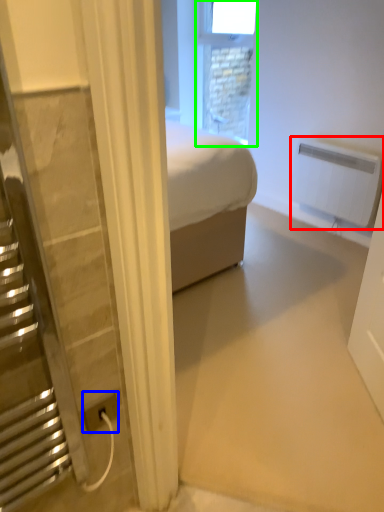
Question: Considering the real-world distances, which object is closest to radiator (highlighted by a red box)? power plugs and sockets (highlighted by a blue box) or window (highlighted by a green box).

Choices:
 (A) power plugs and sockets
 (B) window

Answer: (B)